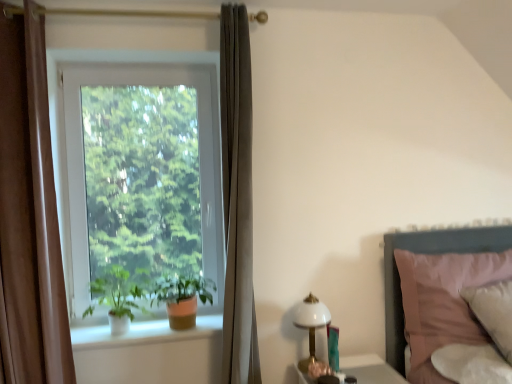
Locate an element on the screen. This screenshot has width=512, height=384. vacant region below white matte plant at window, the first houseplant when ordered from left to right (from a real-world perspective) is located at coordinates (123, 332).